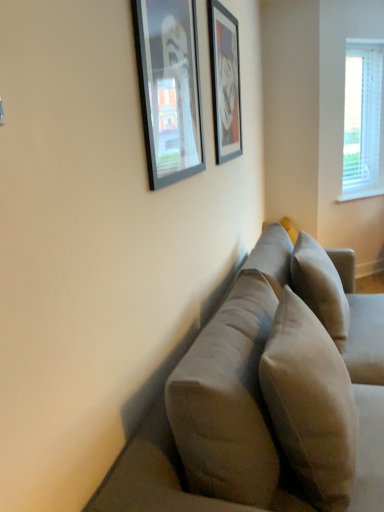
This screenshot has height=512, width=384. I want to click on beige fabric pillow at center, arranged as the 1th pillow when viewed from the back, so click(x=320, y=287).

The width and height of the screenshot is (384, 512). What do you see at coordinates (362, 118) in the screenshot?
I see `white blinds at upper right` at bounding box center [362, 118].

I want to click on matte black picture frame at upper center, which is counted as the second picture frame, starting from the back, so click(x=169, y=88).

In order to face suede-like beige couch at center, should I rotate leftwards or rightwards?

A 14.994 degree turn to the right will do.

The image size is (384, 512). Identify the location of matte black picture frame at upper center, which is counted as the second picture frame, starting from the front. (225, 81).

Describe the element at coordinates (310, 403) in the screenshot. The width and height of the screenshot is (384, 512). I see `suede-like beige pillow at center, which is the 2th pillow from back to front` at that location.

Locate an element on the screen. The height and width of the screenshot is (512, 384). beige fabric pillow at center, arranged as the 1th pillow when viewed from the back is located at coordinates (320, 287).

From the image's perspective, would you say suede-like beige pillow at center, which is the 2th pillow from back to front, is shown under beige fabric pillow at center, arranged as the second pillow when viewed from the front?

Indeed, from the image's perspective, suede-like beige pillow at center, which is the 2th pillow from back to front, is shown beneath beige fabric pillow at center, arranged as the second pillow when viewed from the front.

Considering the relative sizes of suede-like beige pillow at center, which is the 2th pillow from back to front, and beige fabric pillow at center, arranged as the 1th pillow when viewed from the back, in the image provided, is suede-like beige pillow at center, which is the 2th pillow from back to front, shorter than beige fabric pillow at center, arranged as the 1th pillow when viewed from the back,?

Yes, suede-like beige pillow at center, which is the 2th pillow from back to front, is shorter than beige fabric pillow at center, arranged as the 1th pillow when viewed from the back.

Is suede-like beige pillow at center, which is the 2th pillow from back to front, to the right of beige fabric pillow at center, arranged as the second pillow when viewed from the front, from the viewer's perspective?

No.

From the image's perspective, is beige fabric pillow at center, arranged as the second pillow when viewed from the front, positioned above or below suede-like beige couch at center?

beige fabric pillow at center, arranged as the second pillow when viewed from the front, is above suede-like beige couch at center.

Is beige fabric pillow at center, arranged as the 1th pillow when viewed from the back, to the right of suede-like beige couch at center from the viewer's perspective?

Correct, you'll find beige fabric pillow at center, arranged as the 1th pillow when viewed from the back, to the right of suede-like beige couch at center.

Which object is closer to the camera taking this photo, beige fabric pillow at center, arranged as the 1th pillow when viewed from the back, or suede-like beige couch at center?

suede-like beige couch at center is closer to the camera.

Identify the location of studio couch that is in front of the beige fabric pillow at center, arranged as the second pillow when viewed from the front. This screenshot has height=512, width=384. (263, 403).

Considering the relative sizes of matte black picture frame at upper center, which is the second picture frame in right-to-left order, and white blinds at upper right in the image provided, is matte black picture frame at upper center, which is the second picture frame in right-to-left order, wider than white blinds at upper right?

No, matte black picture frame at upper center, which is the second picture frame in right-to-left order, is not wider than white blinds at upper right.

From a real-world perspective, which object rests below the other?

From a 3D spatial view, white blinds at upper right is below.

Is white blinds at upper right inside matte black picture frame at upper center, acting as the 1th picture frame starting from the left?

Actually, white blinds at upper right is outside matte black picture frame at upper center, acting as the 1th picture frame starting from the left.

At what (x,y) coordinates should I click in order to perform the action: click on window lying behind the matte black picture frame at upper center, acting as the 1th picture frame starting from the left. Please return your answer as a coordinate pair (x, y). Image resolution: width=384 pixels, height=512 pixels. Looking at the image, I should click on (362, 118).

From the picture: Considering the sizes of objects suede-like beige pillow at center, which is the 2th pillow from back to front, and suede-like beige couch at center in the image provided, who is taller, suede-like beige pillow at center, which is the 2th pillow from back to front, or suede-like beige couch at center?

Standing taller between the two is suede-like beige couch at center.

Looking at their sizes, would you say suede-like beige pillow at center, which is the 2th pillow from back to front, is wider or thinner than suede-like beige couch at center?

suede-like beige pillow at center, which is the 2th pillow from back to front, is thinner than suede-like beige couch at center.

Is the depth of suede-like beige pillow at center, the first pillow viewed from the front, greater than that of suede-like beige couch at center?

Yes, it is behind suede-like beige couch at center.

From the image's perspective, is suede-like beige couch at center positioned above or below white blinds at upper right?

Clearly, from the image's perspective, suede-like beige couch at center is below white blinds at upper right.

Could you tell me if suede-like beige couch at center is facing white blinds at upper right?

No.

Based on the photo, considering the sizes of suede-like beige couch at center and white blinds at upper right in the image, is suede-like beige couch at center bigger or smaller than white blinds at upper right?

In the image, suede-like beige couch at center appears to be larger than white blinds at upper right.

Between matte black picture frame at upper center, acting as the 1th picture frame starting from the right, and matte black picture frame at upper center, the 1th picture frame positioned from the front, which one has larger size?

Bigger between the two is matte black picture frame at upper center, acting as the 1th picture frame starting from the right.

Considering the relative sizes of matte black picture frame at upper center, the second picture frame from the left, and matte black picture frame at upper center, the 1th picture frame positioned from the front, in the image provided, is matte black picture frame at upper center, the second picture frame from the left, taller than matte black picture frame at upper center, the 1th picture frame positioned from the front,?

Indeed, matte black picture frame at upper center, the second picture frame from the left, has a greater height compared to matte black picture frame at upper center, the 1th picture frame positioned from the front.

Could you measure the distance between matte black picture frame at upper center, the second picture frame from the left, and matte black picture frame at upper center, the 1th picture frame positioned from the front?

matte black picture frame at upper center, the second picture frame from the left, and matte black picture frame at upper center, the 1th picture frame positioned from the front, are 20.93 inches apart.

Can you confirm if matte black picture frame at upper center, the second picture frame from the left, is positioned to the left of matte black picture frame at upper center, the 1th picture frame positioned from the front?

No, matte black picture frame at upper center, the second picture frame from the left, is not to the left of matte black picture frame at upper center, the 1th picture frame positioned from the front.

From a real-world perspective, between suede-like beige pillow at center, the first pillow viewed from the front, and matte black picture frame at upper center, acting as the 1th picture frame starting from the left, who is vertically lower?

suede-like beige pillow at center, the first pillow viewed from the front, from a real-world perspective.

Is suede-like beige pillow at center, the first pillow viewed from the front, closer to the viewer compared to matte black picture frame at upper center, which is the second picture frame in right-to-left order?

Yes, suede-like beige pillow at center, the first pillow viewed from the front, is closer to the camera.

Is suede-like beige pillow at center, the first pillow viewed from the front, oriented towards matte black picture frame at upper center, the 1th picture frame positioned from the front?

No, suede-like beige pillow at center, the first pillow viewed from the front, is not aimed at matte black picture frame at upper center, the 1th picture frame positioned from the front.

Is suede-like beige pillow at center, the first pillow viewed from the front, not inside matte black picture frame at upper center, the 1th picture frame positioned from the front?

That's correct, suede-like beige pillow at center, the first pillow viewed from the front, is outside of matte black picture frame at upper center, the 1th picture frame positioned from the front.

Identify the location of pillow that appears on the left of beige fabric pillow at center, arranged as the 1th pillow when viewed from the back. (310, 403).

Where is `studio couch below the beige fabric pillow at center, arranged as the 1th pillow when viewed from the back (from the image's perspective)`? studio couch below the beige fabric pillow at center, arranged as the 1th pillow when viewed from the back (from the image's perspective) is located at coordinates (263, 403).

From the image, which object appears to be nearer to beige fabric pillow at center, arranged as the second pillow when viewed from the front, suede-like beige couch at center or matte black picture frame at upper center, which is the second picture frame in right-to-left order?

Among the two, suede-like beige couch at center is located nearer to beige fabric pillow at center, arranged as the second pillow when viewed from the front.

From the image, which object appears to be farther from beige fabric pillow at center, arranged as the 1th pillow when viewed from the back, matte black picture frame at upper center, positioned as the 1th picture frame in back-to-front order, or white blinds at upper right?

white blinds at upper right lies further to beige fabric pillow at center, arranged as the 1th pillow when viewed from the back, than the other object.

Estimate the real-world distances between objects in this image. Which object is closer to matte black picture frame at upper center, which is counted as the second picture frame, starting from the front, beige fabric pillow at center, arranged as the second pillow when viewed from the front, or suede-like beige couch at center?

beige fabric pillow at center, arranged as the second pillow when viewed from the front, is closer to matte black picture frame at upper center, which is counted as the second picture frame, starting from the front.

Which object lies further to the anchor point white blinds at upper right, matte black picture frame at upper center, acting as the 1th picture frame starting from the left, or suede-like beige pillow at center, the first pillow viewed from the front?

The object further to white blinds at upper right is suede-like beige pillow at center, the first pillow viewed from the front.

Based on their spatial positions, is matte black picture frame at upper center, which is the second picture frame in right-to-left order, or beige fabric pillow at center, arranged as the 1th pillow when viewed from the back, closer to suede-like beige pillow at center, the first pillow viewed from the front?

Among the two, beige fabric pillow at center, arranged as the 1th pillow when viewed from the back, is located nearer to suede-like beige pillow at center, the first pillow viewed from the front.

In the scene shown: From the image, which object appears to be farther from matte black picture frame at upper center, acting as the 1th picture frame starting from the right, matte black picture frame at upper center, which is counted as the second picture frame, starting from the back, or suede-like beige pillow at center, which is the 2th pillow from back to front?

The object further to matte black picture frame at upper center, acting as the 1th picture frame starting from the right, is suede-like beige pillow at center, which is the 2th pillow from back to front.

Estimate the real-world distances between objects in this image. Which object is closer to suede-like beige pillow at center, the first pillow viewed from the front, beige fabric pillow at center, arranged as the second pillow when viewed from the front, or matte black picture frame at upper center, which is counted as the second picture frame, starting from the back?

The object closer to suede-like beige pillow at center, the first pillow viewed from the front, is beige fabric pillow at center, arranged as the second pillow when viewed from the front.

When comparing their distances from matte black picture frame at upper center, acting as the 1th picture frame starting from the left, does matte black picture frame at upper center, acting as the 1th picture frame starting from the right, or beige fabric pillow at center, arranged as the second pillow when viewed from the front, seem further?

Based on the image, beige fabric pillow at center, arranged as the second pillow when viewed from the front, appears to be further to matte black picture frame at upper center, acting as the 1th picture frame starting from the left.

The image size is (384, 512). Find the location of `pillow located between suede-like beige couch at center and beige fabric pillow at center, arranged as the second pillow when viewed from the front, in the depth direction`. pillow located between suede-like beige couch at center and beige fabric pillow at center, arranged as the second pillow when viewed from the front, in the depth direction is located at coordinates (310, 403).

Where is `picture frame positioned between beige fabric pillow at center, arranged as the 1th pillow when viewed from the back, and white blinds at upper right from near to far`? picture frame positioned between beige fabric pillow at center, arranged as the 1th pillow when viewed from the back, and white blinds at upper right from near to far is located at coordinates (225, 81).

Find the location of a particular element. picture frame between matte black picture frame at upper center, which is counted as the second picture frame, starting from the back, and white blinds at upper right, along the z-axis is located at coordinates coord(225,81).

Where is `pillow between matte black picture frame at upper center, which is counted as the second picture frame, starting from the back, and white blinds at upper right in the front-back direction`? pillow between matte black picture frame at upper center, which is counted as the second picture frame, starting from the back, and white blinds at upper right in the front-back direction is located at coordinates (320, 287).